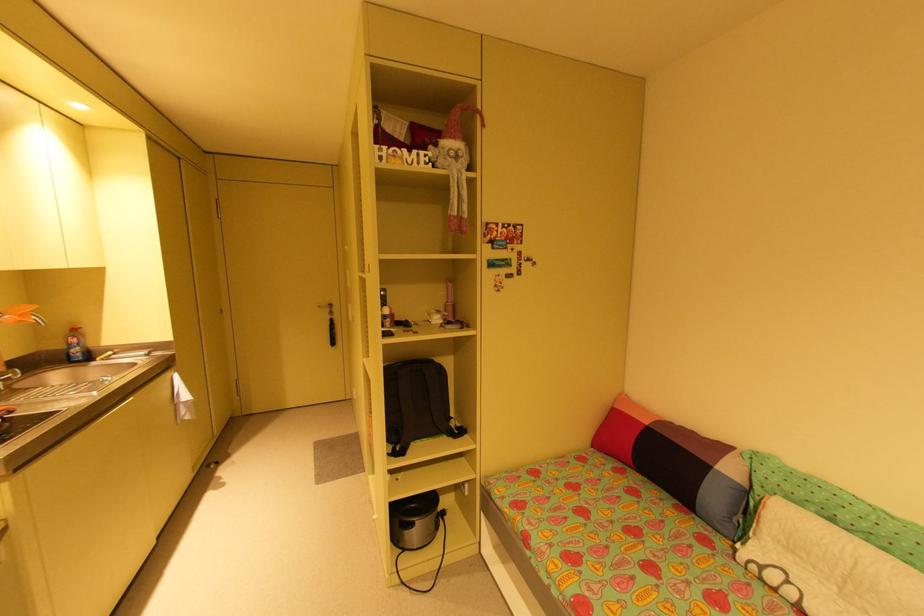
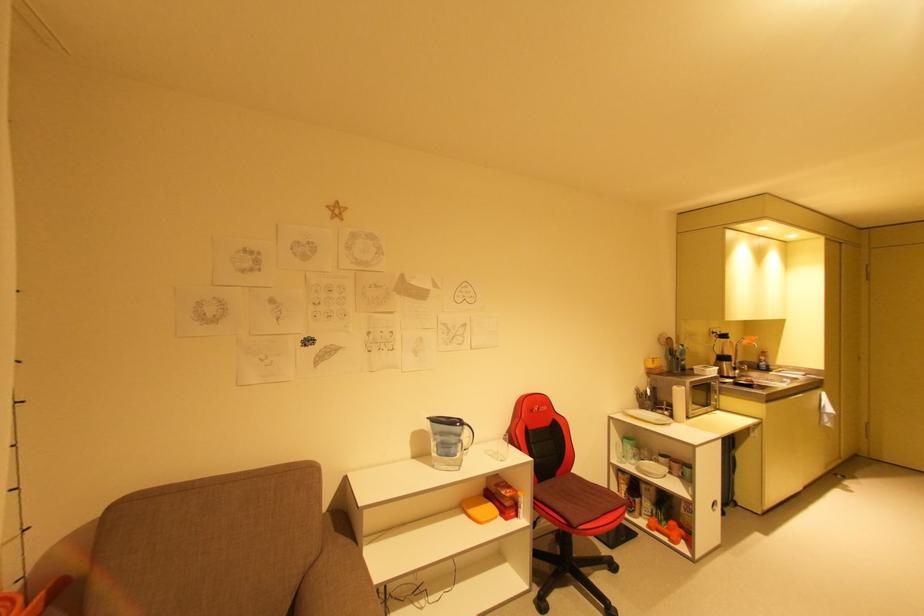
Locate, in the second image, the point that corresponds to (x=99, y=363) in the first image.

(776, 373)